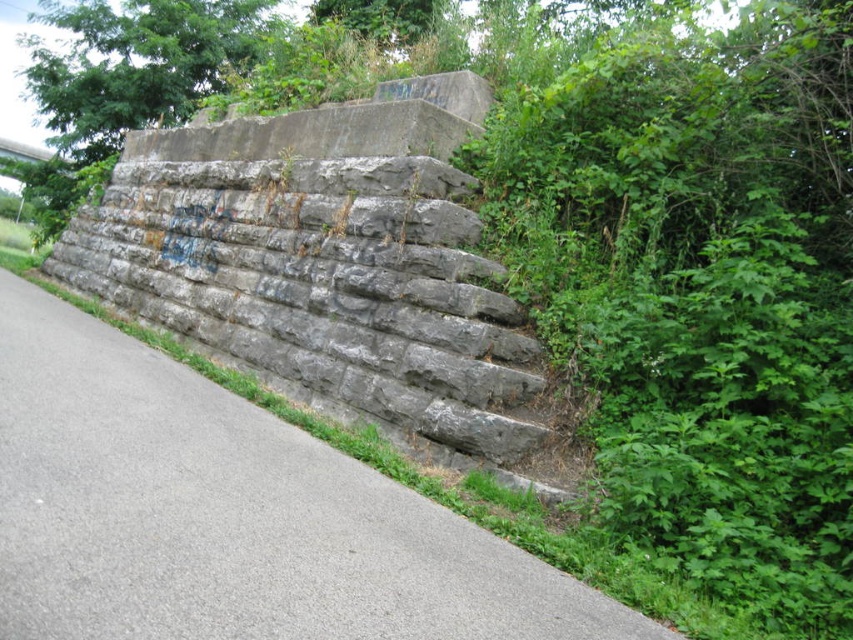
You are standing in a park and want to take a photo of the gray stone wall at center. If your camera has a minimum focusing distance of 4 feet, will you need to move closer or farther away to ensure the wall is in focus?

The gray stone wall at center is 4.23 feet away from the camera. Since the minimum focusing distance is 4 feet, you need to move slightly closer to ensure the wall is within the camera range.

You are standing on the paved path next to the retaining wall in the image. There is a specific point marked at coordinates [228,515]. Can you tell me what structure this point is located on?

The point at [228,515] is on the gray stone wall at center.